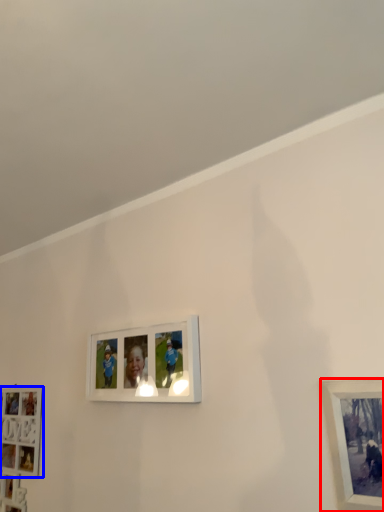
Question: Among these objects, which one is nearest to the camera, picture frame (highlighted by a red box) or picture frame (highlighted by a blue box)?

Choices:
 (A) picture frame
 (B) picture frame

Answer: (A)